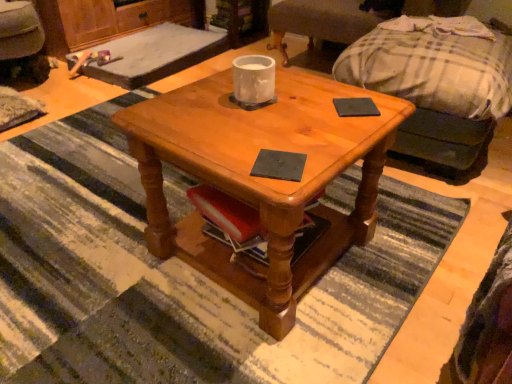
Describe the element at coordinates (437, 92) in the screenshot. I see `plaid fabric couch at upper right` at that location.

Describe the element at coordinates (319, 24) in the screenshot. I see `plaid fabric swivel chair at upper right, acting as the 1th swivel chair starting from the right` at that location.

What do you see at coordinates (261, 178) in the screenshot?
I see `matte wood coffee table at center` at bounding box center [261, 178].

What do you see at coordinates (279, 165) in the screenshot? The height and width of the screenshot is (384, 512). I see `black matte coaster at center, the first pad viewed from the front` at bounding box center [279, 165].

Find the location of a particular element. This screenshot has width=512, height=384. plaid fabric couch at upper right is located at coordinates (437, 92).

From the image's perspective, relative to matte wood coffee table at center, is black matte pad at center, the second pad in the front-to-back sequence, above or below?

black matte pad at center, the second pad in the front-to-back sequence, is above matte wood coffee table at center.

Is there a large distance between black matte pad at center, acting as the second pad starting from the bottom, and matte wood coffee table at center?

No, black matte pad at center, acting as the second pad starting from the bottom, is not far from matte wood coffee table at center.

Which object is wider, black matte pad at center, the second pad in the front-to-back sequence, or matte wood coffee table at center?

Wider between the two is matte wood coffee table at center.

Are black matte pad at center, the 1th pad when ordered from right to left, and velvet dark brown swivel chair at lower left, acting as the first swivel chair starting from the left, far apart?

Indeed, black matte pad at center, the 1th pad when ordered from right to left, is not near velvet dark brown swivel chair at lower left, acting as the first swivel chair starting from the left.

The width and height of the screenshot is (512, 384). In order to click on swivel chair that is the 1st object located above the black matte pad at center, positioned as the 1th pad in back-to-front order (from the image's perspective) in this screenshot , I will do `click(22, 39)`.

Consider the image. Considering the sizes of objects black matte pad at center, acting as the second pad starting from the bottom, and velvet dark brown swivel chair at lower left, acting as the first swivel chair starting from the left, in the image provided, who is smaller, black matte pad at center, acting as the second pad starting from the bottom, or velvet dark brown swivel chair at lower left, acting as the first swivel chair starting from the left,?

black matte pad at center, acting as the second pad starting from the bottom, is smaller.

Is plaid fabric couch at upper right turned away from velvet dark brown swivel chair at lower left, placed as the second swivel chair when sorted from right to left?

plaid fabric couch at upper right is not turned away from velvet dark brown swivel chair at lower left, placed as the second swivel chair when sorted from right to left.

Considering the sizes of objects plaid fabric couch at upper right and velvet dark brown swivel chair at lower left, acting as the first swivel chair starting from the left, in the image provided, who is smaller, plaid fabric couch at upper right or velvet dark brown swivel chair at lower left, acting as the first swivel chair starting from the left,?

With smaller size is velvet dark brown swivel chair at lower left, acting as the first swivel chair starting from the left.

Could you measure the distance between plaid fabric couch at upper right and velvet dark brown swivel chair at lower left, placed as the second swivel chair when sorted from right to left?

A distance of 6.41 feet exists between plaid fabric couch at upper right and velvet dark brown swivel chair at lower left, placed as the second swivel chair when sorted from right to left.

Considering the sizes of objects plaid fabric couch at upper right and velvet dark brown swivel chair at lower left, placed as the second swivel chair when sorted from right to left, in the image provided, who is thinner, plaid fabric couch at upper right or velvet dark brown swivel chair at lower left, placed as the second swivel chair when sorted from right to left,?

With smaller width is plaid fabric couch at upper right.

Relative to black matte pad at center, the second pad in the front-to-back sequence, is matte wood coffee table at center in front or behind?

Visually, matte wood coffee table at center is located in front of black matte pad at center, the second pad in the front-to-back sequence.

The image size is (512, 384). I want to click on the 2nd pad behind when counting from the matte wood coffee table at center, so click(355, 107).

Does matte wood coffee table at center turn towards black matte pad at center, positioned as the first pad in top-to-bottom order?

No, matte wood coffee table at center is not facing towards black matte pad at center, positioned as the first pad in top-to-bottom order.

Is plaid fabric couch at upper right next to black matte pad at center, positioned as the first pad in top-to-bottom order, and touching it?

There is a gap between plaid fabric couch at upper right and black matte pad at center, positioned as the first pad in top-to-bottom order.

Between plaid fabric couch at upper right and black matte pad at center, acting as the second pad starting from the bottom, which one is positioned behind?

plaid fabric couch at upper right is more distant.

What's the angular difference between plaid fabric couch at upper right and black matte pad at center, acting as the second pad starting from the bottom,'s facing directions?

The angle between the facing direction of plaid fabric couch at upper right and the facing direction of black matte pad at center, acting as the second pad starting from the bottom, is 36.1 degrees.

Is plaid fabric couch at upper right oriented away from black matte pad at center, the 1th pad when ordered from right to left?

No.

Could black matte pad at center, the 1th pad when ordered from right to left, be considered to be inside black matte coaster at center, the 1th pad from the bottom?

No.

The height and width of the screenshot is (384, 512). Identify the location of pad located above the black matte coaster at center, which is the first pad from left to right (from the image's perspective). (355, 107).

Is the surface of black matte coaster at center, the first pad viewed from the front, in direct contact with black matte pad at center, the 2th pad positioned from the left?

No, black matte coaster at center, the first pad viewed from the front, is not making contact with black matte pad at center, the 2th pad positioned from the left.

Measure the distance from black matte coaster at center, which ranks as the 2th pad in top-to-bottom order, to black matte pad at center, positioned as the 1th pad in back-to-front order.

The distance of black matte coaster at center, which ranks as the 2th pad in top-to-bottom order, from black matte pad at center, positioned as the 1th pad in back-to-front order, is 29.90 centimeters.

From a real-world perspective, count 2nd swivel chairs downward from the black matte coaster at center, positioned as the second pad in back-to-front order, and point to it. Please provide its 2D coordinates.

[(22, 39)]

Considering the relative sizes of velvet dark brown swivel chair at lower left, acting as the first swivel chair starting from the left, and black matte coaster at center, positioned as the second pad in back-to-front order, in the image provided, is velvet dark brown swivel chair at lower left, acting as the first swivel chair starting from the left, wider than black matte coaster at center, positioned as the second pad in back-to-front order,?

Yes, velvet dark brown swivel chair at lower left, acting as the first swivel chair starting from the left, is wider than black matte coaster at center, positioned as the second pad in back-to-front order.

Is velvet dark brown swivel chair at lower left, acting as the first swivel chair starting from the left, inside or outside of black matte coaster at center, positioned as the second pad in back-to-front order?

velvet dark brown swivel chair at lower left, acting as the first swivel chair starting from the left, exists outside the volume of black matte coaster at center, positioned as the second pad in back-to-front order.

Based on the photo, is there a large distance between velvet dark brown swivel chair at lower left, acting as the first swivel chair starting from the left, and black matte coaster at center, the second pad positioned from the right?

Yes, velvet dark brown swivel chair at lower left, acting as the first swivel chair starting from the left, and black matte coaster at center, the second pad positioned from the right, are quite far apart.

Where is `the 2nd pad located above the matte wood coffee table at center (from a real-world perspective)`? the 2nd pad located above the matte wood coffee table at center (from a real-world perspective) is located at coordinates (355, 107).

Find the location of a particular element. the 1st pad in front when counting from the velvet dark brown swivel chair at lower left, placed as the second swivel chair when sorted from right to left is located at coordinates (355, 107).

From the image, which object appears to be farther from black matte coaster at center, the second pad positioned from the right, plaid fabric swivel chair at upper right, placed as the 2th swivel chair when sorted from left to right, or matte wood coffee table at center?

Among the two, plaid fabric swivel chair at upper right, placed as the 2th swivel chair when sorted from left to right, is located further to black matte coaster at center, the second pad positioned from the right.

From the picture: From the image, which object appears to be farther from black matte coaster at center, the first pad viewed from the front, matte wood coffee table at center or plaid fabric swivel chair at upper right, acting as the 1th swivel chair starting from the right?

Among the two, plaid fabric swivel chair at upper right, acting as the 1th swivel chair starting from the right, is located further to black matte coaster at center, the first pad viewed from the front.

Estimate the real-world distances between objects in this image. Which object is further from plaid fabric swivel chair at upper right, acting as the 1th swivel chair starting from the right, black matte coaster at center, the 1th pad from the bottom, or plaid fabric couch at upper right?

Based on the image, black matte coaster at center, the 1th pad from the bottom, appears to be further to plaid fabric swivel chair at upper right, acting as the 1th swivel chair starting from the right.

When comparing their distances from velvet dark brown swivel chair at lower left, acting as the first swivel chair starting from the left, does plaid fabric swivel chair at upper right, placed as the 2th swivel chair when sorted from left to right, or matte wood coffee table at center seem closer?

Among the two, plaid fabric swivel chair at upper right, placed as the 2th swivel chair when sorted from left to right, is located nearer to velvet dark brown swivel chair at lower left, acting as the first swivel chair starting from the left.

Considering their positions, is plaid fabric swivel chair at upper right, acting as the 1th swivel chair starting from the right, positioned further to velvet dark brown swivel chair at lower left, placed as the second swivel chair when sorted from right to left, than plaid fabric couch at upper right?

plaid fabric couch at upper right.

Based on their spatial positions, is velvet dark brown swivel chair at lower left, acting as the first swivel chair starting from the left, or plaid fabric couch at upper right further from matte wood coffee table at center?

velvet dark brown swivel chair at lower left, acting as the first swivel chair starting from the left, is further to matte wood coffee table at center.

From the picture: Which object lies nearer to the anchor point velvet dark brown swivel chair at lower left, acting as the first swivel chair starting from the left, plaid fabric couch at upper right or plaid fabric swivel chair at upper right, placed as the 2th swivel chair when sorted from left to right?

plaid fabric swivel chair at upper right, placed as the 2th swivel chair when sorted from left to right, is positioned closer to the anchor velvet dark brown swivel chair at lower left, acting as the first swivel chair starting from the left.

Based on their spatial positions, is black matte pad at center, the 1th pad when ordered from right to left, or plaid fabric couch at upper right closer to plaid fabric swivel chair at upper right, placed as the 2th swivel chair when sorted from left to right?

The object closer to plaid fabric swivel chair at upper right, placed as the 2th swivel chair when sorted from left to right, is plaid fabric couch at upper right.

Find the location of a particular element. studio couch between black matte coaster at center, positioned as the second pad in back-to-front order, and plaid fabric swivel chair at upper right, placed as the 2th swivel chair when sorted from left to right, from front to back is located at coordinates (437, 92).

Locate an element on the screen. Image resolution: width=512 pixels, height=384 pixels. pad located between matte wood coffee table at center and black matte pad at center, acting as the second pad starting from the bottom, in the depth direction is located at coordinates (279, 165).

Image resolution: width=512 pixels, height=384 pixels. What are the coordinates of `coffee table situated between velvet dark brown swivel chair at lower left, acting as the first swivel chair starting from the left, and plaid fabric swivel chair at upper right, acting as the 1th swivel chair starting from the right, from left to right` in the screenshot? It's located at (261, 178).

Locate an element on the screen. studio couch positioned between matte wood coffee table at center and plaid fabric swivel chair at upper right, acting as the 1th swivel chair starting from the right, from near to far is located at coordinates (437, 92).